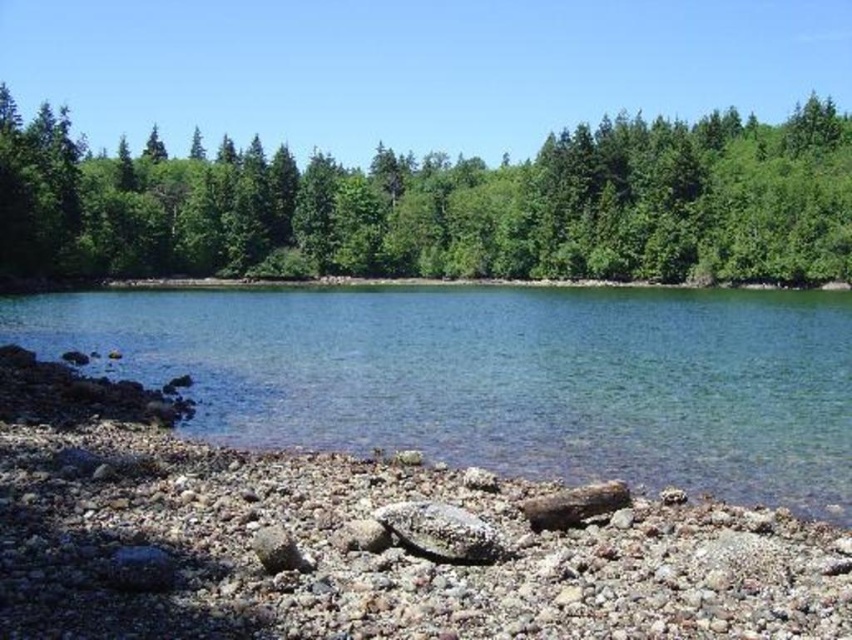
You are standing on the pebbled beach and want to cross to the other side of the clear water at center. There is a path behind the green leafy trees at upper center. Which direction should you head towards to avoid the water?

The clear water at center is thinner than the green leafy trees at upper center, so you should head towards the green leafy trees at upper center to avoid the wider part of the water.

You are standing at the edge of the pebbled beach and want to reach the clear water at center. Which direction should you walk to get there?

The clear water at center is located at coordinates point (499, 376), so you should walk towards the center of the image to reach it.